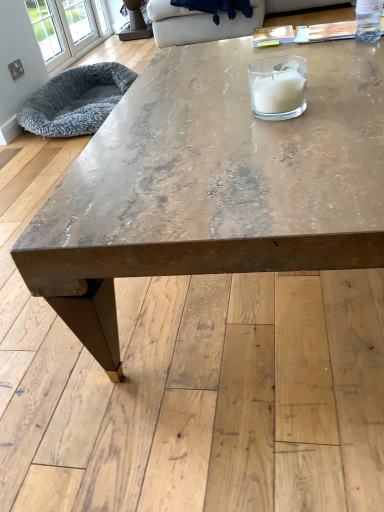
I want to click on white glass candle at upper center, so click(278, 91).

This screenshot has width=384, height=512. What are the coordinates of `beige fabric couch at upper center` in the screenshot? It's located at (219, 22).

Where is `white glass window at upper left`? The image size is (384, 512). white glass window at upper left is located at coordinates (67, 29).

You are a GUI agent. You are given a task and a screenshot of the screen. Output one action in this format:
    pyautogui.click(x=<x>, y=<y>)
    Task: Click on the distressed wood coffee table at center
    
    Given the screenshot: What is the action you would take?
    pyautogui.click(x=213, y=184)

I want to click on clear glass bottle at upper right, so click(368, 20).

What's the angular difference between white glass candle at upper center and beige fabric couch at upper center's facing directions?

They differ by 92.1 degrees in their facing directions.

From the image's perspective, which is below, white glass candle at upper center or beige fabric couch at upper center?

From the image's view, white glass candle at upper center is below.

Is point (261, 97) closer or farther from the camera than point (180, 8)?

Point (261, 97) is positioned closer to the camera compared to point (180, 8).

Is beige fabric couch at upper center shorter than distressed wood coffee table at center?

Yes.

Based on the photo, from the image's perspective, is beige fabric couch at upper center located above distressed wood coffee table at center?

Yes, from the image's perspective, beige fabric couch at upper center is above distressed wood coffee table at center.

Looking at this image, which is more to the right, beige fabric couch at upper center or distressed wood coffee table at center?

From the viewer's perspective, distressed wood coffee table at center appears more on the right side.

Identify the location of couch above the white glass candle at upper center (from the image's perspective). (219, 22).

From a real-world perspective, is beige fabric couch at upper center physically below white glass candle at upper center?

Yes, from a real-world perspective, beige fabric couch at upper center is beneath white glass candle at upper center.

In the scene shown: Which object is thinner, beige fabric couch at upper center or white glass candle at upper center?

Thinner between the two is white glass candle at upper center.

From the image's perspective, is beige fabric couch at upper center above white glass candle at upper center?

Yes, from the image's perspective, beige fabric couch at upper center is above white glass candle at upper center.

Is distressed wood coffee table at center positioned with its back to white glass window at upper left?

distressed wood coffee table at center does not have its back to white glass window at upper left.

From a real-world perspective, between distressed wood coffee table at center and white glass window at upper left, who is vertically higher?

white glass window at upper left.

Can you confirm if distressed wood coffee table at center is bigger than white glass window at upper left?

Yes.

Would you say distressed wood coffee table at center is a long distance from white glass window at upper left?

Absolutely, distressed wood coffee table at center is distant from white glass window at upper left.

Looking at their sizes, would you say beige fabric couch at upper center is wider or thinner than clear glass bottle at upper right?

Clearly, beige fabric couch at upper center has more width compared to clear glass bottle at upper right.

Considering the sizes of objects beige fabric couch at upper center and clear glass bottle at upper right in the image provided, who is bigger, beige fabric couch at upper center or clear glass bottle at upper right?

With larger size is beige fabric couch at upper center.

Can clear glass bottle at upper right be found inside beige fabric couch at upper center?

No.

Is clear glass bottle at upper right touching beige fabric couch at upper center?

There is a gap between clear glass bottle at upper right and beige fabric couch at upper center.

Does clear glass bottle at upper right turn towards beige fabric couch at upper center?

No, clear glass bottle at upper right is not turned towards beige fabric couch at upper center.

Is clear glass bottle at upper right surrounding beige fabric couch at upper center?

No, clear glass bottle at upper right does not contain beige fabric couch at upper center.

Considering the sizes of clear glass bottle at upper right and beige fabric couch at upper center in the image, is clear glass bottle at upper right wider or thinner than beige fabric couch at upper center?

Considering their sizes, clear glass bottle at upper right looks slimmer than beige fabric couch at upper center.

Which of these two, clear glass bottle at upper right or distressed wood coffee table at center, is smaller?

Smaller between the two is clear glass bottle at upper right.

From a real-world perspective, between clear glass bottle at upper right and distressed wood coffee table at center, who is vertically higher?

clear glass bottle at upper right is physically above.

From the image's perspective, would you say clear glass bottle at upper right is positioned over distressed wood coffee table at center?

Indeed, from the image's perspective, clear glass bottle at upper right is shown above distressed wood coffee table at center.

This screenshot has width=384, height=512. I want to click on candle that appears on the right of beige fabric couch at upper center, so click(278, 91).

You are a GUI agent. You are given a task and a screenshot of the screen. Output one action in this format:
    pyautogui.click(x=<x>, y=<y>)
    Task: Click on the couch behind the distressed wood coffee table at center
    Image resolution: width=384 pixels, height=512 pixels.
    Given the screenshot: What is the action you would take?
    pyautogui.click(x=219, y=22)

When comparing their distances from distressed wood coffee table at center, does beige fabric couch at upper center or white glass candle at upper center seem closer?

white glass candle at upper center is closer to distressed wood coffee table at center.

Looking at the image, which one is located further to distressed wood coffee table at center, clear glass bottle at upper right or beige fabric couch at upper center?

beige fabric couch at upper center is further to distressed wood coffee table at center.

From the image, which object appears to be nearer to white glass window at upper left, distressed wood coffee table at center or clear glass bottle at upper right?

The object closer to white glass window at upper left is distressed wood coffee table at center.

Estimate the real-world distances between objects in this image. Which object is further from clear glass bottle at upper right, beige fabric couch at upper center or distressed wood coffee table at center?

Based on the image, beige fabric couch at upper center appears to be further to clear glass bottle at upper right.

Looking at the image, which one is located further to beige fabric couch at upper center, gray fluffy pet bed at left or distressed wood coffee table at center?

Among the two, distressed wood coffee table at center is located further to beige fabric couch at upper center.

Considering their positions, is distressed wood coffee table at center positioned closer to beige fabric couch at upper center than clear glass bottle at upper right?

clear glass bottle at upper right is positioned closer to the anchor beige fabric couch at upper center.

Considering their positions, is white glass candle at upper center positioned closer to white glass window at upper left than clear glass bottle at upper right?

clear glass bottle at upper right is closer to white glass window at upper left.

Looking at the image, which one is located closer to clear glass bottle at upper right, white glass candle at upper center or distressed wood coffee table at center?

Based on the image, white glass candle at upper center appears to be nearer to clear glass bottle at upper right.

Identify the location of beverage between distressed wood coffee table at center and white glass window at upper left from front to back. This screenshot has width=384, height=512. (368, 20).

Locate an element on the screen. The image size is (384, 512). armchair between white glass candle at upper center and beige fabric couch at upper center along the z-axis is located at coordinates (76, 100).

Find the location of a particular element. The image size is (384, 512). beverage located between white glass candle at upper center and beige fabric couch at upper center in the depth direction is located at coordinates [x=368, y=20].

I want to click on beverage between distressed wood coffee table at center and gray fluffy pet bed at left along the z-axis, so [x=368, y=20].